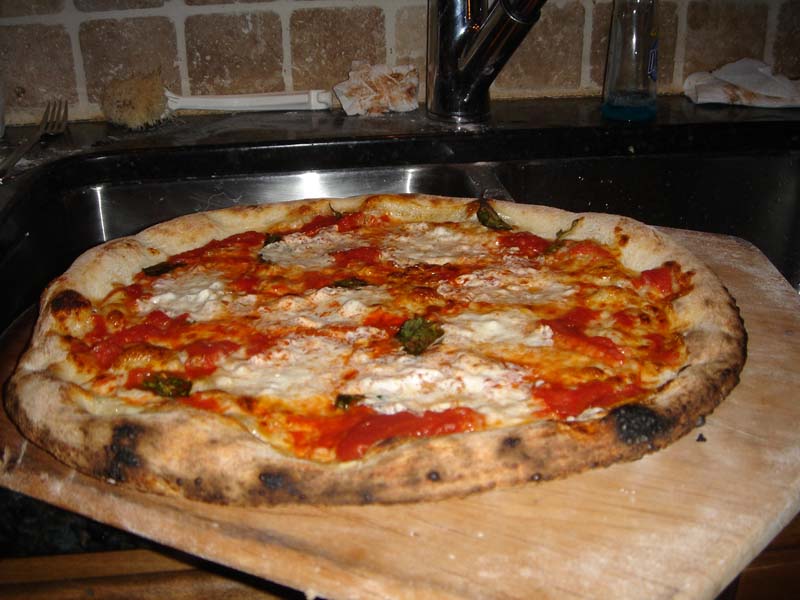
This screenshot has height=600, width=800. I want to click on dirty, used napkin, so click(373, 84).